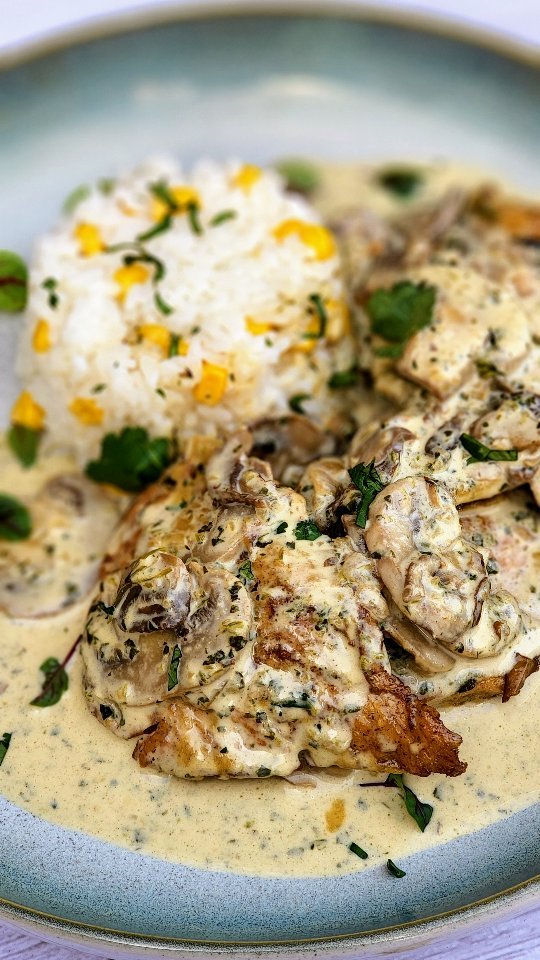
I want to click on rim of plate, so click(59, 925), click(516, 898), click(54, 44), click(481, 36).